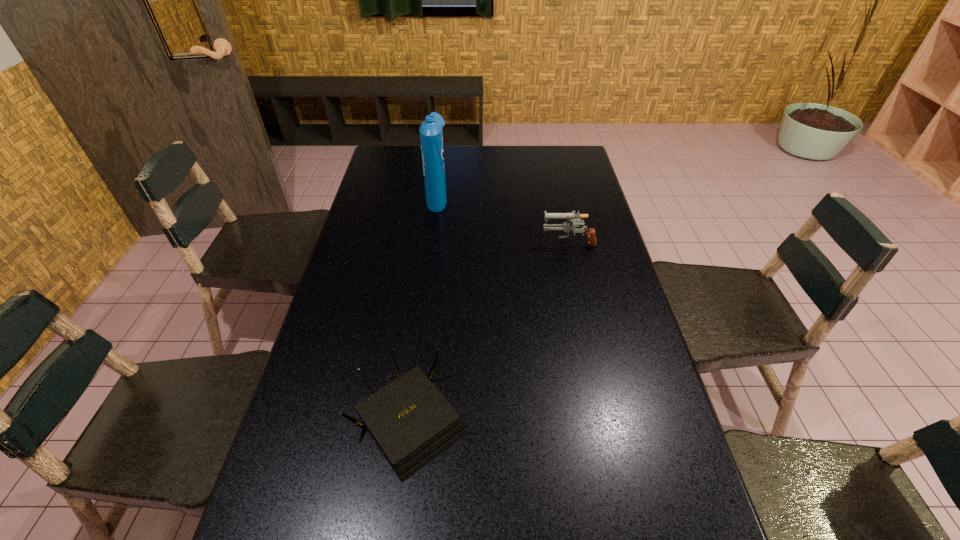
Locate an element on the screen. Image resolution: width=960 pixels, height=540 pixels. free space between the nearest object and the shampoo is located at coordinates (423, 310).

This screenshot has height=540, width=960. I want to click on the second closest object to the second nearest object, so click(411, 422).

Identify which object is the nearest to the shortest object. Please provide its 2D coordinates. Your answer should be formatted as a tuple, i.e. [(x, y)], where the tuple contains the x and y coordinates of a point satisfying the conditions above.

[(566, 226)]